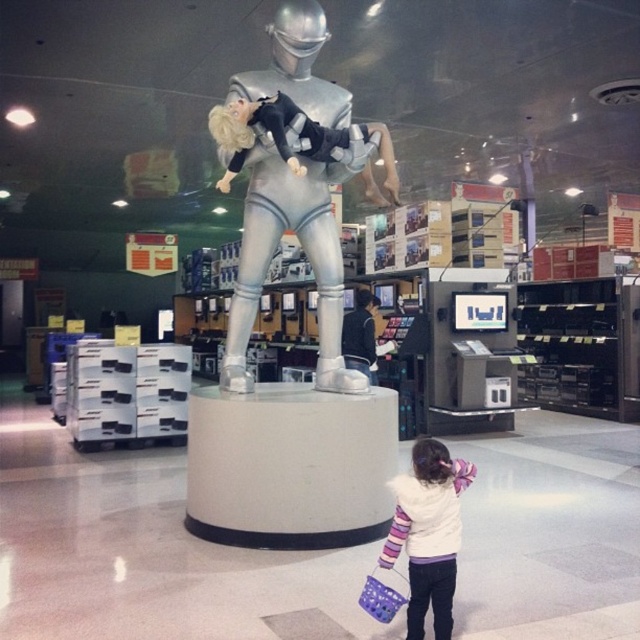
Does silver metallic statue at center appear on the left side of white fleece jacket at lower right?

Correct, you'll find silver metallic statue at center to the left of white fleece jacket at lower right.

Does silver metallic statue at center have a lesser height compared to white fleece jacket at lower right?

No, silver metallic statue at center is not shorter than white fleece jacket at lower right.

This screenshot has width=640, height=640. I want to click on silver metallic statue at center, so click(x=294, y=184).

Can you confirm if white fleece jacket at lower right is positioned below plastic purple shopping basket at lower right?

Actually, white fleece jacket at lower right is above plastic purple shopping basket at lower right.

Can you confirm if white fleece jacket at lower right is positioned to the right of plastic purple shopping basket at lower right?

Yes, white fleece jacket at lower right is to the right of plastic purple shopping basket at lower right.

Who is more distant from viewer, (408, 577) or (388, 589)?

The point (408, 577) is more distant.

At what (x,y) coordinates should I click in order to perform the action: click on white fleece jacket at lower right. Please return your answer as a coordinate pair (x, y). Looking at the image, I should click on (428, 532).

How distant is silver metallic statue at center from plastic purple shopping basket at lower right?

A distance of 2.28 meters exists between silver metallic statue at center and plastic purple shopping basket at lower right.

Is point (236, 348) positioned after point (371, 609)?

Yes, point (236, 348) is behind point (371, 609).

Between point (316, 193) and point (381, 600), which one is positioned behind?

The point (316, 193) is behind.

Find the location of `silver metallic statue at center`. silver metallic statue at center is located at coordinates (294, 184).